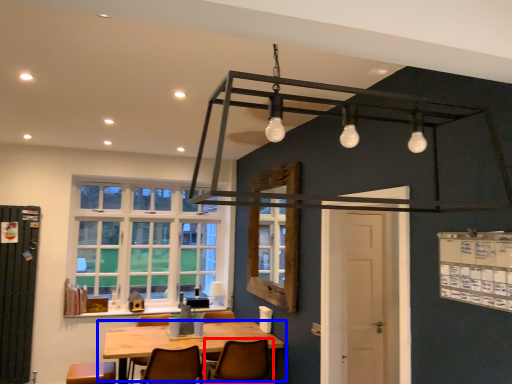
Question: Which object is further to the camera taking this photo, chair (highlighted by a red box) or table (highlighted by a blue box)?

Choices:
 (A) chair
 (B) table

Answer: (A)